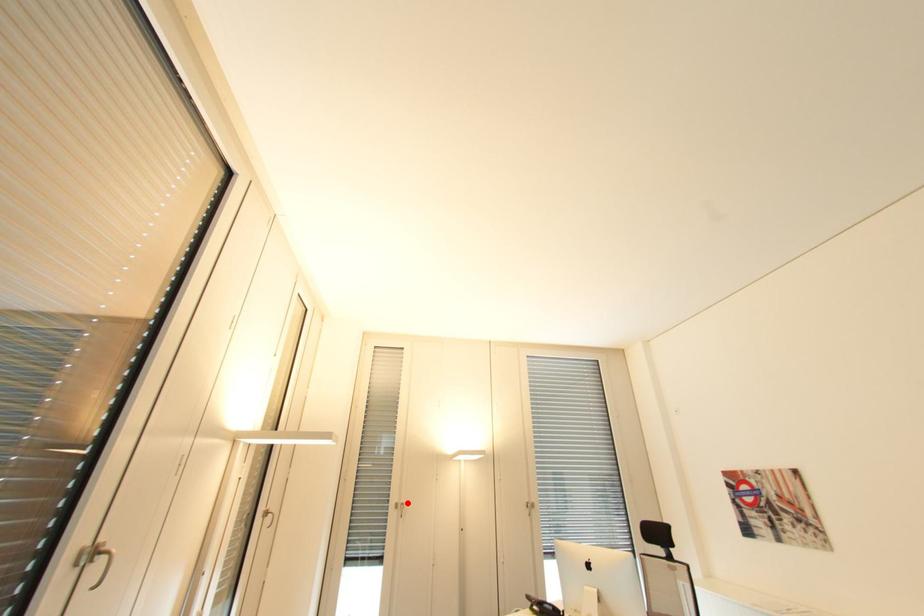
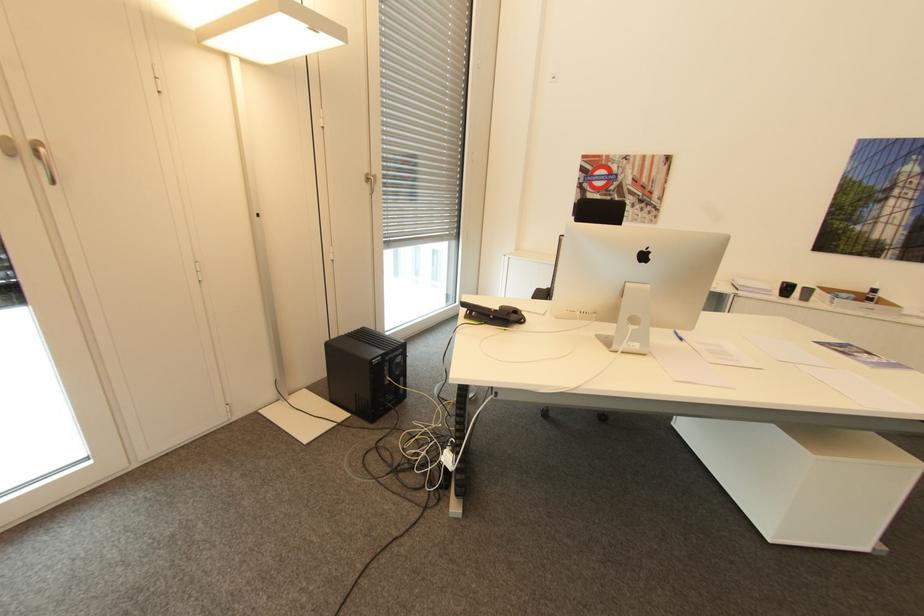
Find the pixel in the second image that matches the highlighted location in the first image.

(43, 144)